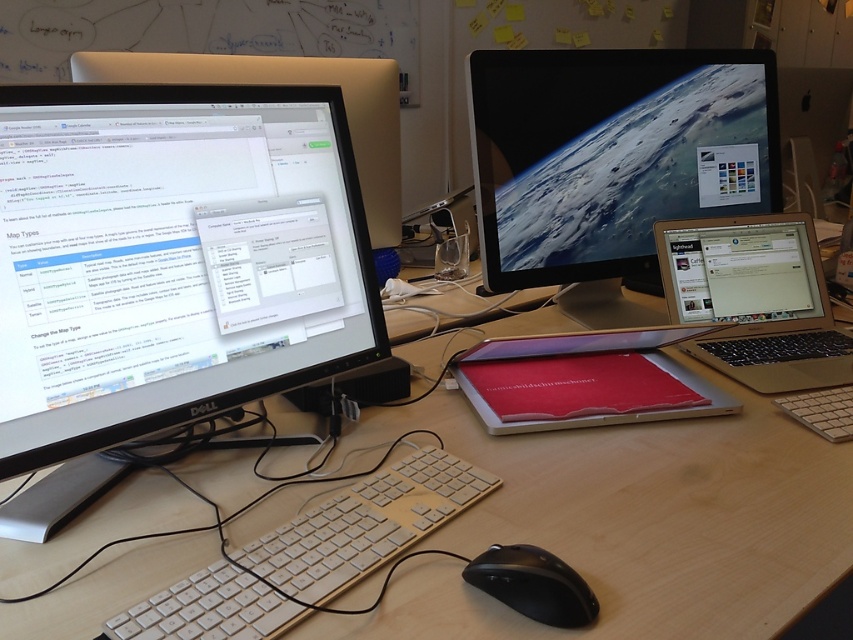
Does matte black monitor at left lie behind white plastic keyboard at center?

Yes, matte black monitor at left is behind white plastic keyboard at center.

Describe the element at coordinates (171, 257) in the screenshot. Image resolution: width=853 pixels, height=640 pixels. I see `matte black monitor at left` at that location.

What do you see at coordinates (171, 257) in the screenshot? This screenshot has width=853, height=640. I see `matte black monitor at left` at bounding box center [171, 257].

You are a GUI agent. You are given a task and a screenshot of the screen. Output one action in this format:
    pyautogui.click(x=<x>, y=<y>)
    Task: Click on the matte black monitor at left
    
    Given the screenshot: What is the action you would take?
    pyautogui.click(x=171, y=257)

The height and width of the screenshot is (640, 853). What do you see at coordinates (171, 257) in the screenshot?
I see `matte black monitor at left` at bounding box center [171, 257].

Is point (268, 145) farther from viewer compared to point (494, 582)?

Yes, point (268, 145) is behind point (494, 582).

This screenshot has height=640, width=853. I want to click on matte black monitor at left, so click(x=171, y=257).

Between point (415, 480) and point (634, 387), which one is positioned behind?

Point (634, 387)

Which is in front, point (297, 540) or point (506, 419)?

Positioned in front is point (297, 540).

Who is more distant from viewer, (161, 611) or (639, 342)?

The point (639, 342) is more distant.

Locate an element on the screen. white plastic keyboard at center is located at coordinates (310, 554).